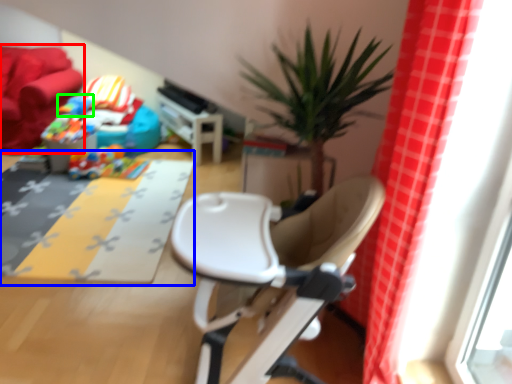
Question: Estimate the real-world distances between objects in this image. Which object is farther from couch (highlighted by a red box), mat (highlighted by a blue box) or toy (highlighted by a green box)?

Choices:
 (A) mat
 (B) toy

Answer: (A)